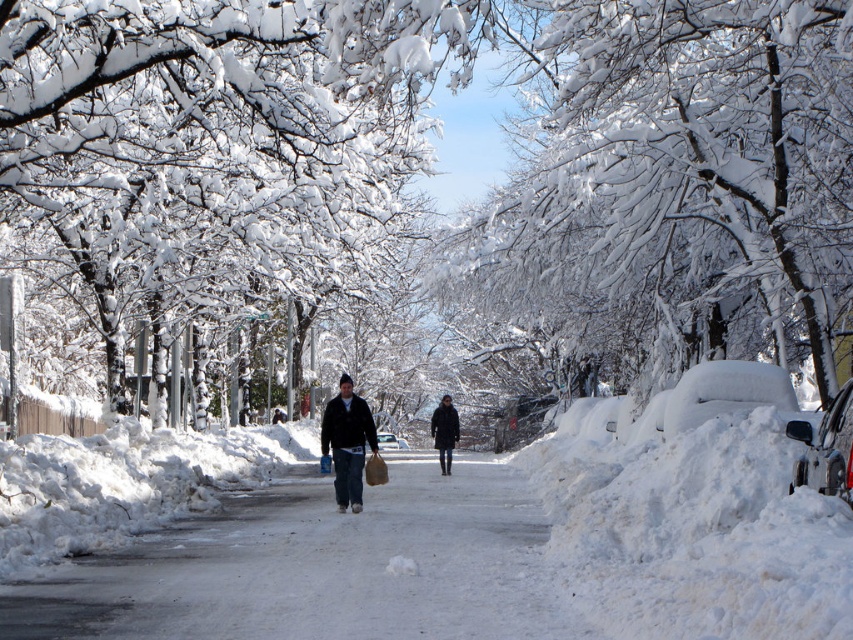
You are standing at the origin point of the image. There is a silver metallic car at right located at point (x=827, y=449). Can you tell me the coordinates of the silver metallic car at right?

The silver metallic car at right is located at point (x=827, y=449).